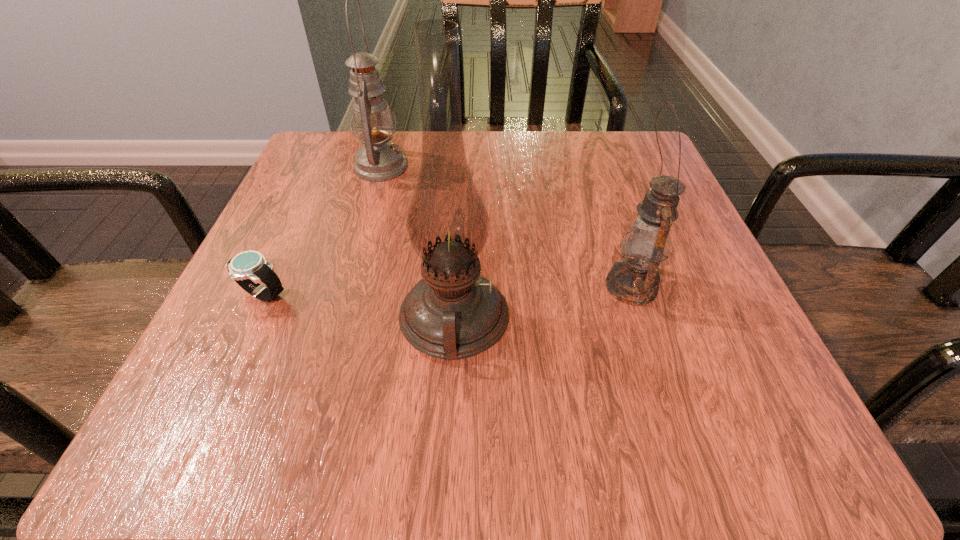
The height and width of the screenshot is (540, 960). Find the location of `free space at the far left corner of the desktop`. free space at the far left corner of the desktop is located at coordinates (299, 169).

This screenshot has height=540, width=960. What are the coordinates of `vacant area at the near left corner` in the screenshot? It's located at (188, 390).

Identify the location of vacant space at the near right corner of the desktop. (711, 397).

Locate an element on the screen. Image resolution: width=960 pixels, height=540 pixels. empty space between the rightmost object and the second object from right to left is located at coordinates (542, 303).

I want to click on vacant region between the leftmost oil lamp and the rightmost object, so click(x=506, y=226).

Locate an element on the screen. This screenshot has height=540, width=960. empty location between the second oil lamp from left to right and the leftmost object is located at coordinates (359, 307).

You are a GUI agent. You are given a task and a screenshot of the screen. Output one action in this format:
    pyautogui.click(x=<x>, y=<y>)
    Task: Click on the empty space that is in between the farthest oil lamp and the leftmost object
    The width and height of the screenshot is (960, 540).
    Given the screenshot: What is the action you would take?
    pyautogui.click(x=323, y=231)

The image size is (960, 540). I want to click on free space between the shortest object and the farthest object, so click(x=323, y=231).

Identify the location of free space between the rightmost oil lamp and the leftmost oil lamp. The image size is (960, 540). (506, 226).

Identify which object is the third nearest to the tallest oil lamp. Please provide its 2D coordinates. Your answer should be formatted as a tuple, i.e. [(x, y)], where the tuple contains the x and y coordinates of a point satisfying the conditions above.

[(378, 160)]